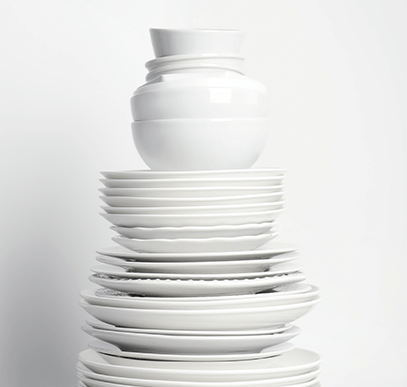
Locate an element on the screen. bowls is located at coordinates (190, 41), (206, 58), (204, 65), (168, 77), (175, 85), (166, 102), (177, 136).